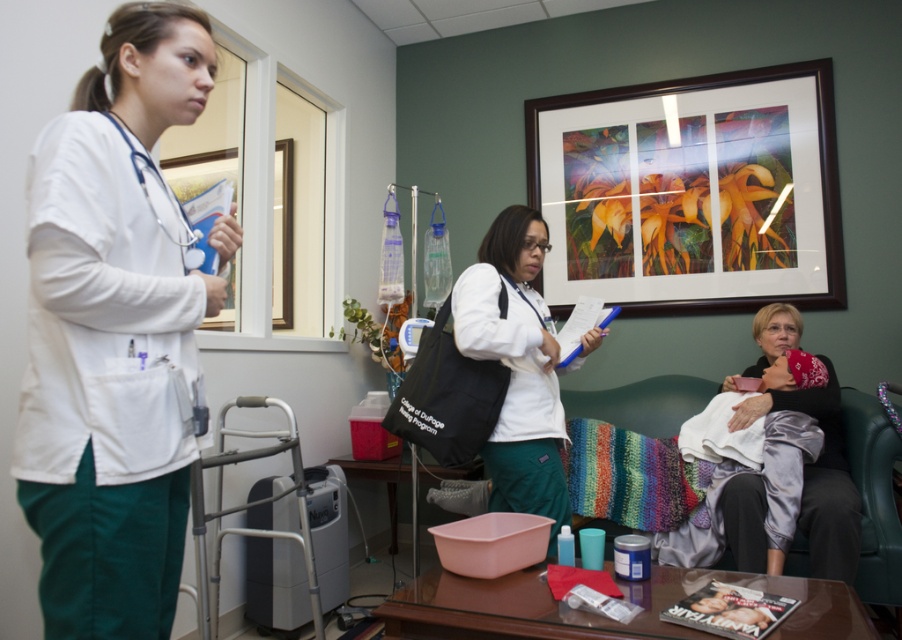
Question: Does white smooth uniform at left have a larger size compared to wooden framed artwork at upper center?

Choices:
 (A) yes
 (B) no

Answer: (B)

Question: Which of the following is the farthest from the observer?

Choices:
 (A) wooden framed artwork at upper center
 (B) white matte coat at center
 (C) white matte stethoscope at left
 (D) white smooth uniform at left

Answer: (A)

Question: Where is white matte coat at center located in relation to white matte stethoscope at left in the image?

Choices:
 (A) below
 (B) above

Answer: (A)

Question: Does white matte coat at center appear under white matte stethoscope at left?

Choices:
 (A) yes
 (B) no

Answer: (A)

Question: Which point appears closest to the camera in this image?

Choices:
 (A) (146, 163)
 (B) (509, 234)
 (C) (840, 566)

Answer: (A)

Question: Considering the real-world distances, which object is farthest from the wooden framed artwork at upper center?

Choices:
 (A) white matte coat at center
 (B) white smooth uniform at left
 (C) white matte stethoscope at left

Answer: (C)